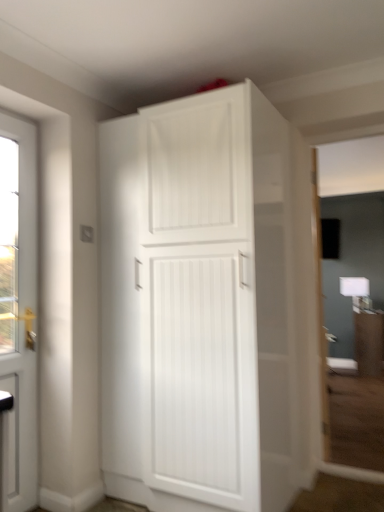
Question: Visually, is white matte cabinet at upper center positioned to the left or to the right of white glossy door at left?

Choices:
 (A) left
 (B) right

Answer: (B)

Question: Considering the positions of white matte cabinet at upper center and white glossy door at left in the image, is white matte cabinet at upper center wider or thinner than white glossy door at left?

Choices:
 (A) thin
 (B) wide

Answer: (B)

Question: Which is nearer to the white glossy door at left?

Choices:
 (A) white matte cabinet at upper center
 (B) matte white cabinet at center

Answer: (A)

Question: Which object is the farthest from the white matte cabinet at upper center?

Choices:
 (A) white glossy door at left
 (B) matte white cabinet at center

Answer: (B)